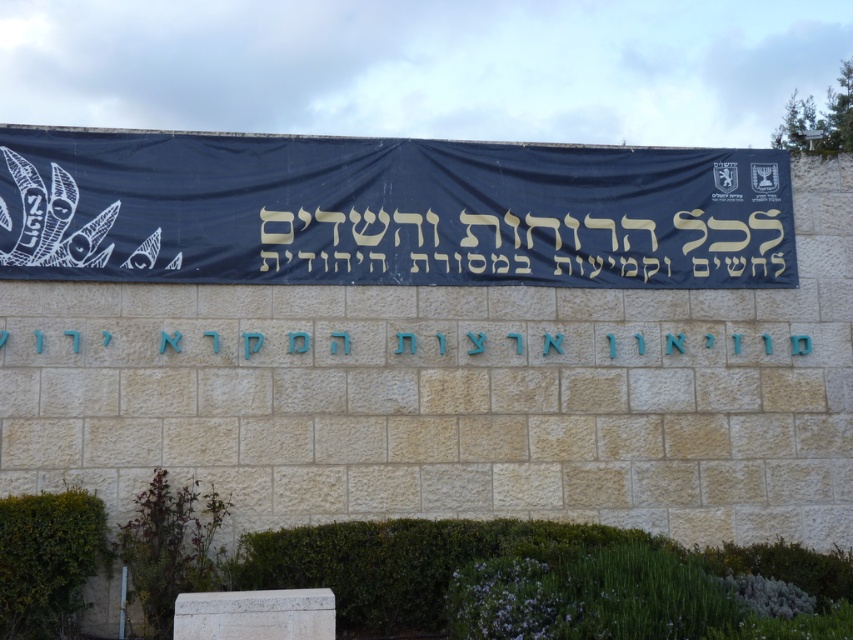
Question: Which point appears farthest from the camera in this image?

Choices:
 (A) (125, 198)
 (B) (641, 348)

Answer: (B)

Question: Which object appears closest to the camera in this image?

Choices:
 (A) blue stone sign at center
 (B) black fabric banner at center

Answer: (A)

Question: Can you confirm if black fabric banner at center is positioned to the left of blue stone sign at center?

Choices:
 (A) yes
 (B) no

Answer: (B)

Question: Which of the following is the farthest from the observer?

Choices:
 (A) (547, 336)
 (B) (267, 268)

Answer: (A)

Question: Is black fabric banner at center thinner than blue stone sign at center?

Choices:
 (A) yes
 (B) no

Answer: (B)

Question: Is black fabric banner at center positioned at the back of blue stone sign at center?

Choices:
 (A) no
 (B) yes

Answer: (B)